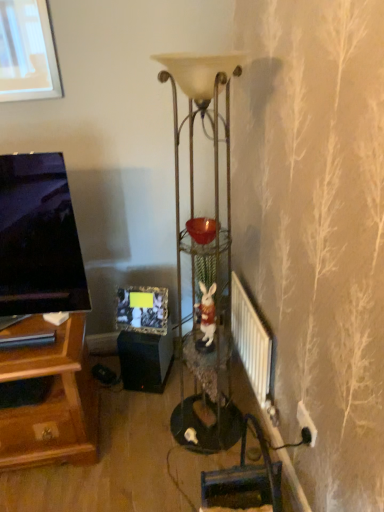
Find the location of a particular element. vacant space in white metallic radiator at lower right (from a real-world perspective) is located at coordinates (244, 389).